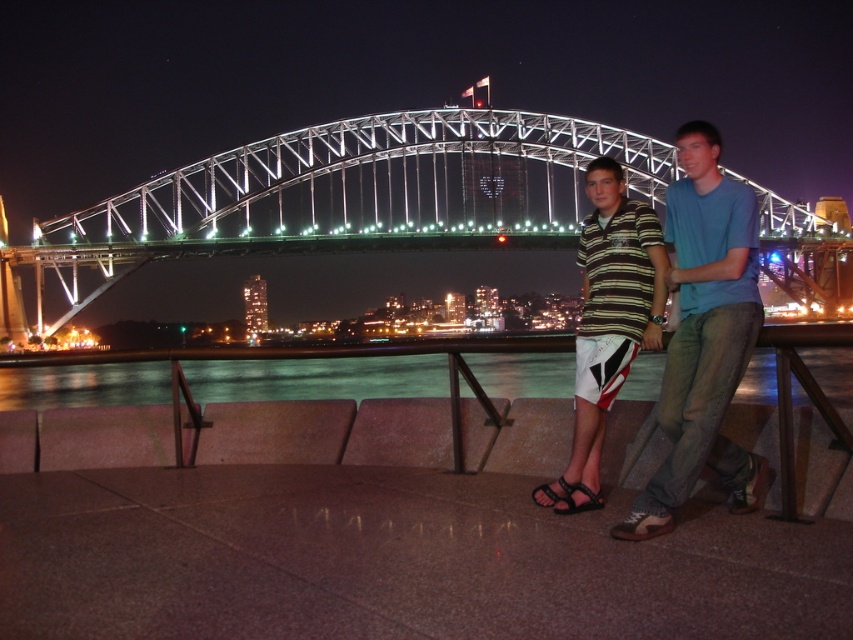
Question: Which is farther from the blue cotton shirt at center?

Choices:
 (A) black leather sandal at lower center
 (B) metallic steel bridge at center
 (C) black rubber sandal at lower center
 (D) striped cotton shirt at center

Answer: (B)

Question: Among these points, which one is farthest from the camera?

Choices:
 (A) (664, 388)
 (B) (595, 508)

Answer: (A)

Question: Is the position of black leather sandal at lower center more distant than that of black rubber sandal at lower center?

Choices:
 (A) yes
 (B) no

Answer: (B)

Question: Which object is positioned farthest from the black leather sandal at lower center?

Choices:
 (A) black rubber sandal at lower center
 (B) striped cotton shirt at center

Answer: (B)

Question: Is metallic steel bridge at center wider than black leather sandal at lower center?

Choices:
 (A) yes
 (B) no

Answer: (A)

Question: From the image, what is the correct spatial relationship of metallic steel bridge at center in relation to black leather sandal at lower center?

Choices:
 (A) below
 (B) above

Answer: (B)